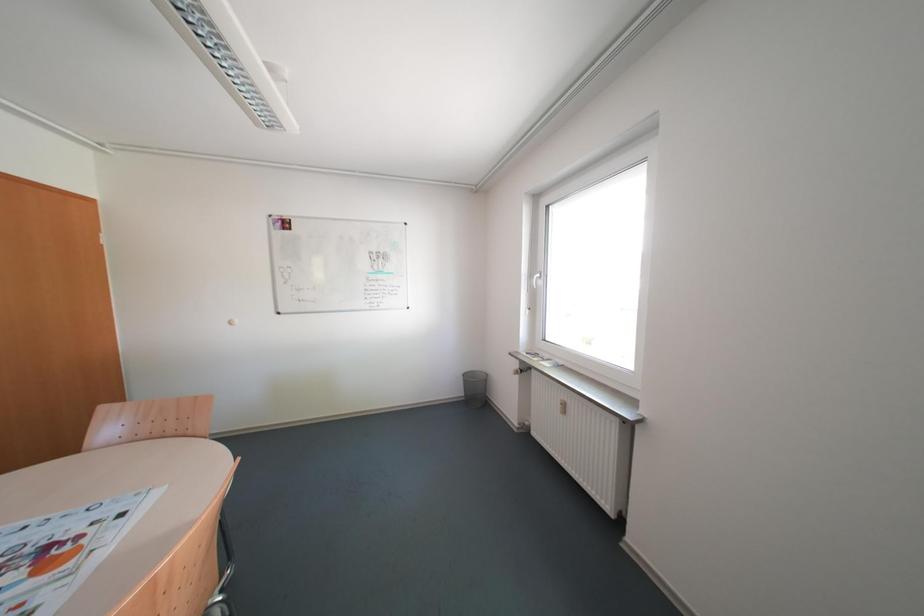
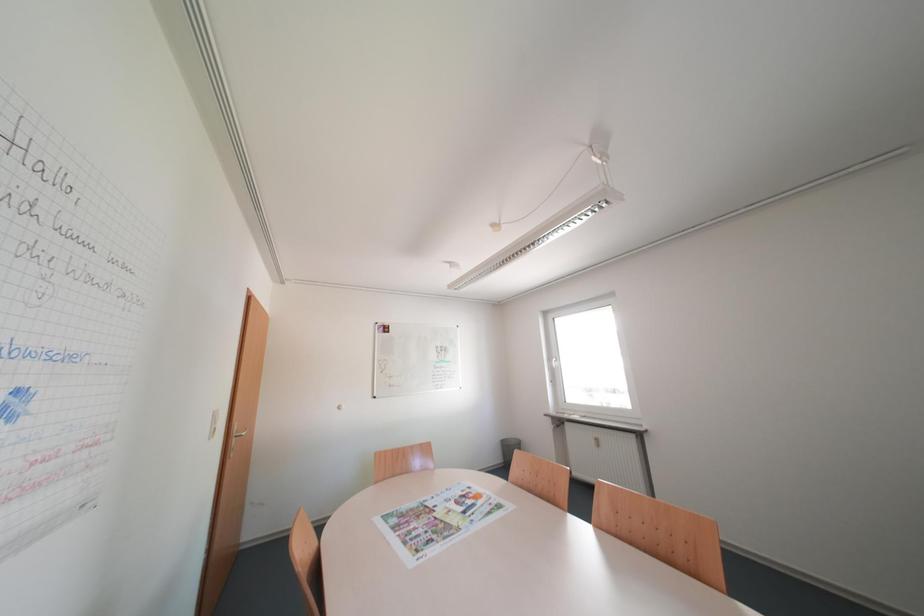
The images are taken continuously from a first-person perspective. In which direction are you moving?

The movement direction of the cameraman is left, backward.